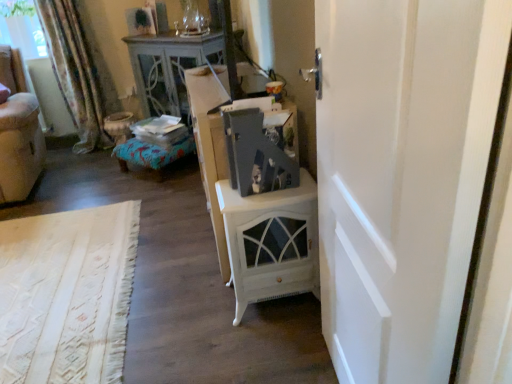
Question: Is white painted wood nightstand at center wider or thinner than floral fabric curtain at left?

Choices:
 (A) wide
 (B) thin

Answer: (A)

Question: From a real-world perspective, is white painted wood nightstand at center physically located above or below floral fabric curtain at left?

Choices:
 (A) below
 (B) above

Answer: (A)

Question: Which object is the farthest from the white painted wood nightstand at center?

Choices:
 (A) velvet beige armchair at left
 (B) white glossy cabinet at center
 (C) transparent glass window screen at upper left
 (D) wooden cabinet at center
 (E) floral fabric curtain at left

Answer: (C)

Question: Which object is positioned closest to the transparent glass window screen at upper left?

Choices:
 (A) white painted wood nightstand at center
 (B) floral fabric curtain at left
 (C) white glossy cabinet at center
 (D) white matte door at right
 (E) wooden cabinet at center

Answer: (B)